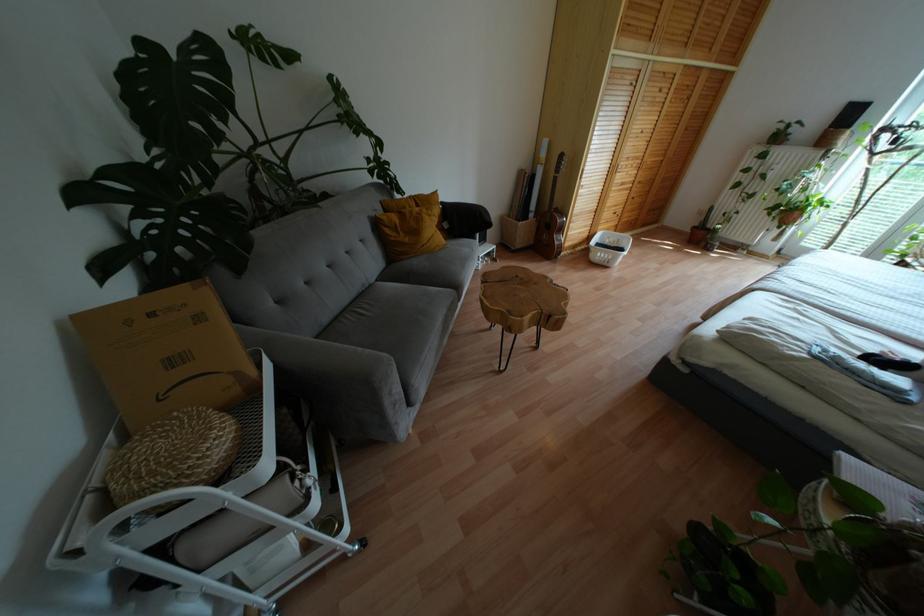
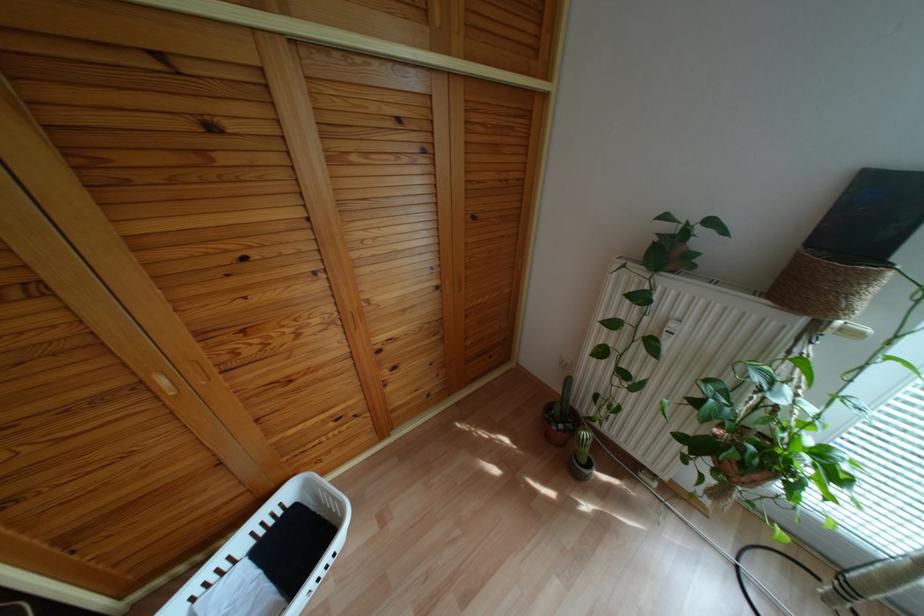
Which direction would the cameraman need to move to produce the second image?

The cameraman moved toward right, forward.